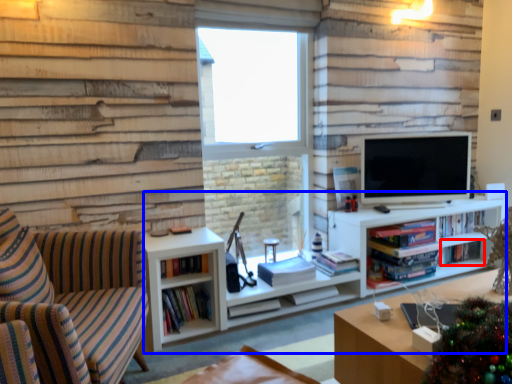
Question: Among these objects, which one is nearest to the camera, book (highlighted by a red box) or entertainment center (highlighted by a blue box)?

Choices:
 (A) book
 (B) entertainment center

Answer: (B)